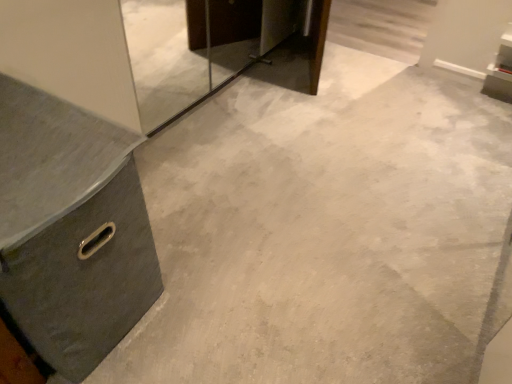
Measure the distance between matte gray fabric chest of drawers at left and camera.

A distance of 30.81 inches exists between matte gray fabric chest of drawers at left and camera.

Measure the distance between point (70, 242) and camera.

35.20 inches.

I want to click on matte gray fabric chest of drawers at left, so click(x=71, y=229).

What do you see at coordinates (71, 229) in the screenshot?
I see `matte gray fabric chest of drawers at left` at bounding box center [71, 229].

Locate an element on the screen. The width and height of the screenshot is (512, 384). matte gray fabric chest of drawers at left is located at coordinates (71, 229).